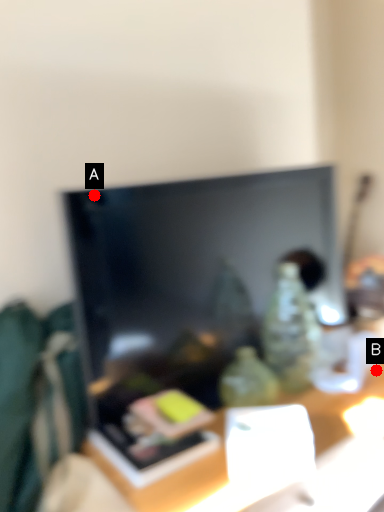
Question: Two points are circled on the image, labeled by A and B beside each circle. Which of the following is the closest to the observer?

Choices:
 (A) A is closer
 (B) B is closer

Answer: (A)